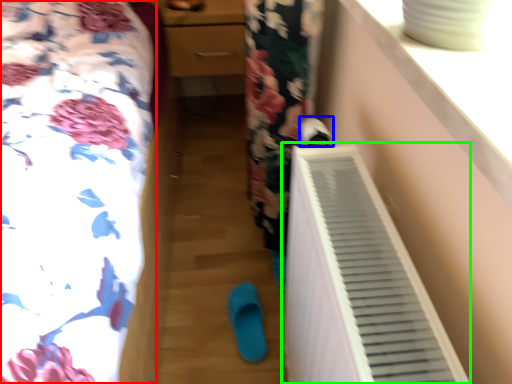
Question: Which object is the closest to the furniture (highlighted by a red box)? Choose among these: footwear (highlighted by a blue box) or air conditioning (highlighted by a green box).

Choices:
 (A) footwear
 (B) air conditioning

Answer: (B)